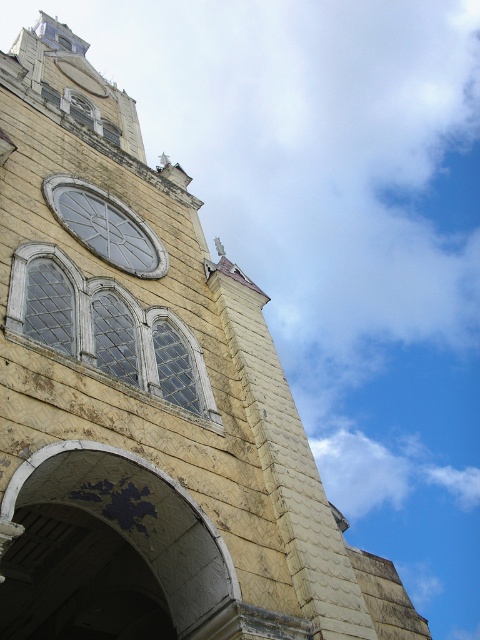
Question: Can you confirm if clear glass windows at center is positioned to the right of clear glass window at upper left?

Choices:
 (A) no
 (B) yes

Answer: (B)

Question: Which object appears farthest from the camera in this image?

Choices:
 (A) clear glass window at center
 (B) clear glass window at upper left
 (C) clear glass windows at center

Answer: (A)

Question: Among these points, which one is farthest from the camera?

Choices:
 (A) (106, 294)
 (B) (16, 300)

Answer: (A)

Question: Which object is the farthest from the clear glass window at upper left?

Choices:
 (A) clear glass windows at center
 (B) clear glass window at center

Answer: (B)

Question: Is the position of clear glass windows at center more distant than that of clear glass window at center?

Choices:
 (A) yes
 (B) no

Answer: (B)

Question: Observing the image, what is the correct spatial positioning of clear glass window at upper left in reference to clear glass window at center?

Choices:
 (A) left
 (B) right

Answer: (A)